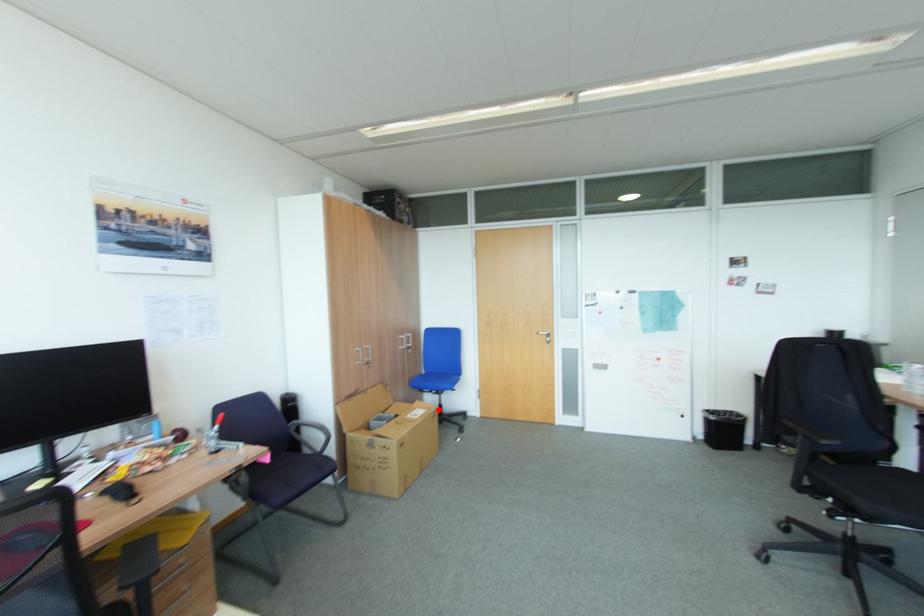
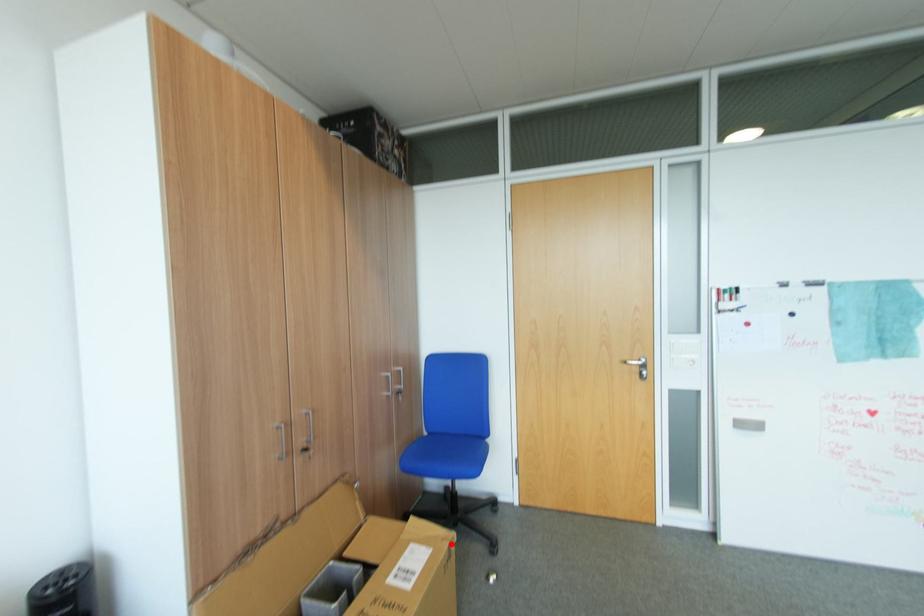
I am providing you with two images of the same scene from different viewpoints. A red point is marked on the first image and another point is marked on the second image. Are the points marked in image1 and image2 representing the same 3D position?

Yes